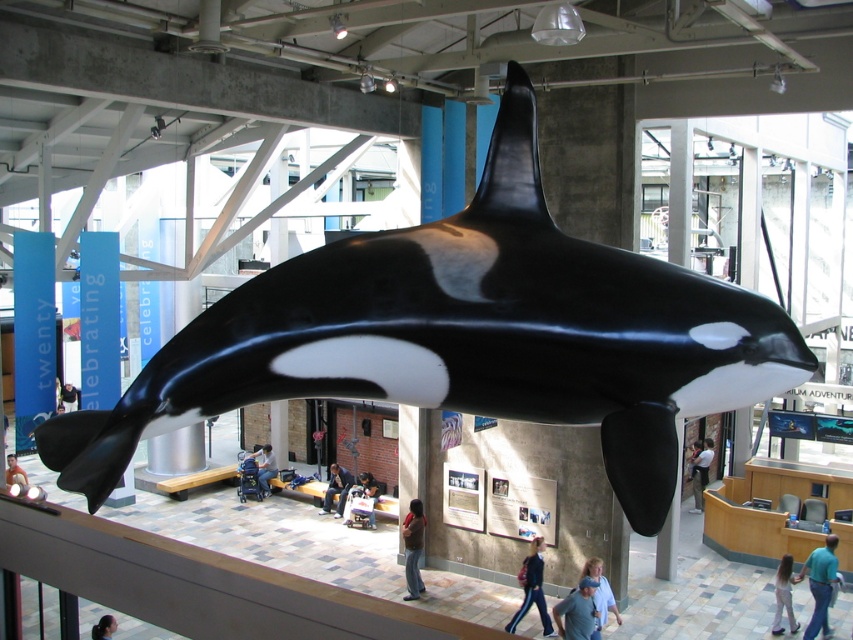
You are a visitor at the museum and you see the denim jacket at lower center and the dark blue jeans at center. Which clothing item appears smaller in the image?

The denim jacket at lower center appears smaller than the dark blue jeans at center.

You are a visitor at the museum and want to take a photo of the orca whale model. You notice a denim jacket at lower center and dark blue jeans at center. Which object should you position yourself closer to if you want to ensure both the orca and the people below are in your shot?

You should position yourself closer to the dark blue jeans at center because the denim jacket at lower center is to the right of it, allowing you to frame both the orca above and the people below effectively.